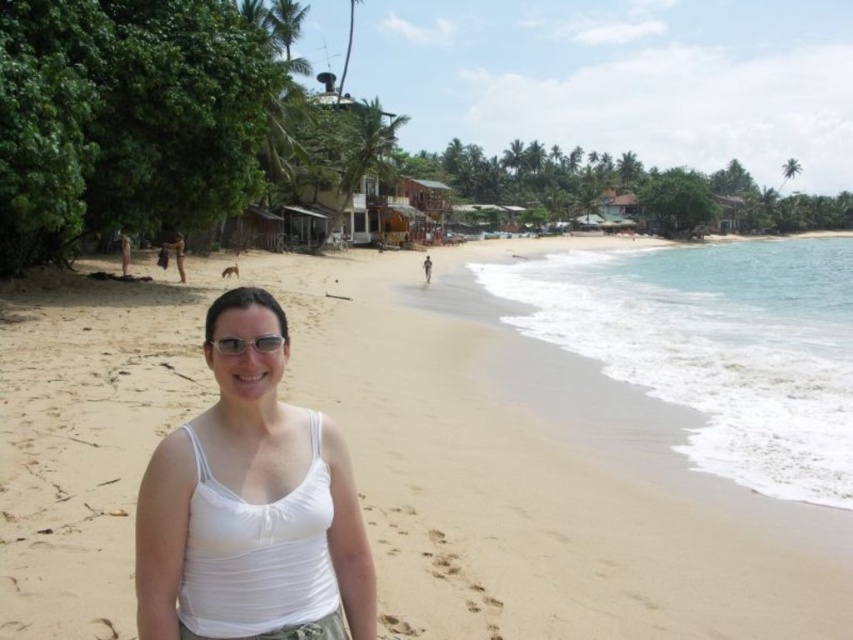
Which is more to the right, light beige sand at center or clear plastic glasses at center?

From the viewer's perspective, clear plastic glasses at center appears more on the right side.

Describe the element at coordinates (534, 472) in the screenshot. I see `light beige sand at center` at that location.

This screenshot has width=853, height=640. Find the location of `light beige sand at center`. light beige sand at center is located at coordinates (534, 472).

Is white fabric at center taller than clear plastic glasses at center?

Yes, white fabric at center is taller than clear plastic glasses at center.

Where is `white fabric at center`? white fabric at center is located at coordinates (248, 499).

The image size is (853, 640). I want to click on white fabric at center, so click(x=248, y=499).

Who is positioned more to the right, light beige sand at center or white fabric at center?

white fabric at center

Which is above, light beige sand at center or white fabric at center?

Positioned higher is light beige sand at center.

The image size is (853, 640). What do you see at coordinates (534, 472) in the screenshot?
I see `light beige sand at center` at bounding box center [534, 472].

What are the coordinates of `light beige sand at center` in the screenshot? It's located at (534, 472).